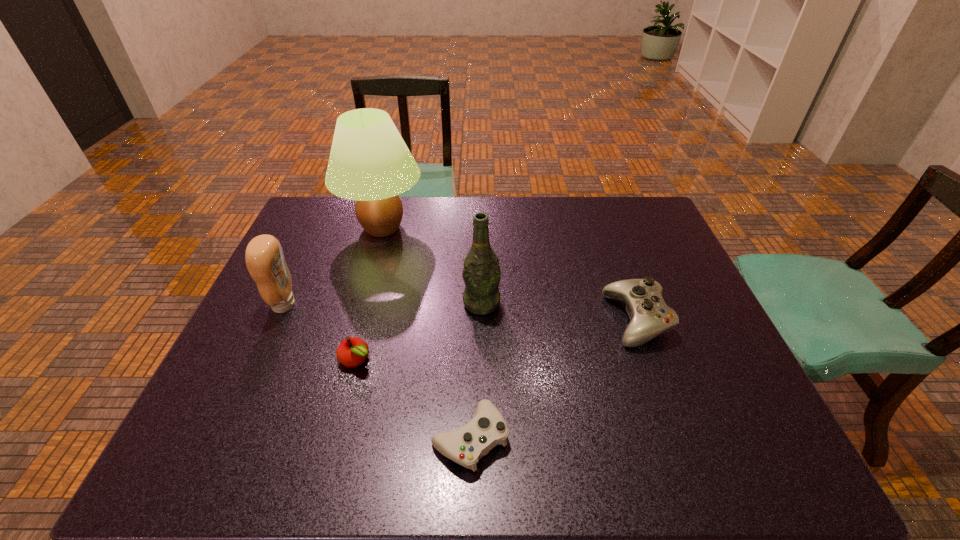
You are a GUI agent. You are given a task and a screenshot of the screen. Output one action in this format:
    pyautogui.click(x=<x>, y=<y>)
    Task: Click on the vacant space located on the shade of the farthest object
    
    Given the screenshot: What is the action you would take?
    pyautogui.click(x=462, y=228)

The image size is (960, 540). I want to click on vacant space located on the surface of the beer bottle, so click(482, 429).

Locate an element on the screen. The image size is (960, 540). free space located 0.250m on the label of the fourth shortest object is located at coordinates (390, 305).

The image size is (960, 540). I want to click on vacant region located 0.110m on the right of the taller control, so click(x=708, y=320).

Where is `free location located 0.180m on the left of the apple`? The width and height of the screenshot is (960, 540). free location located 0.180m on the left of the apple is located at coordinates (263, 359).

I want to click on vacant space located 0.330m on the back of the nearer control, so click(x=472, y=299).

You are a GUI agent. You are given a task and a screenshot of the screen. Output one action in this format:
    pyautogui.click(x=<x>, y=<y>)
    Task: Click on the object located at the far edge
    
    Given the screenshot: What is the action you would take?
    pyautogui.click(x=369, y=162)

I want to click on object at the near edge, so 467,445.

Where is `lampshade that is positioned at the left edge`? lampshade that is positioned at the left edge is located at coordinates (369, 162).

The image size is (960, 540). Identify the location of condiment situated at the left edge. (264, 257).